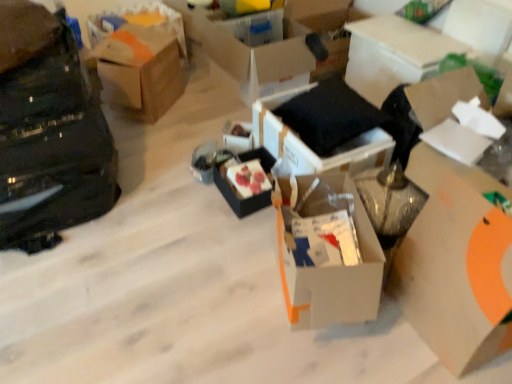
Question: Is point click(138, 38) positioned closer to the camera than point click(342, 150)?

Choices:
 (A) farther
 (B) closer

Answer: (A)

Question: Is brown cardboard box at upper left, positioned as the first box in left-to-right order, inside or outside of black fabric cushion at center, the 4th box in the right-to-left sequence?

Choices:
 (A) outside
 (B) inside

Answer: (A)

Question: Considering the real-world distances, which object is closest to the white cardboard box at right, the third box in the right-to-left sequence?

Choices:
 (A) white cardboard box at upper right, which ranks as the third storage box in left-to-right order
 (B) white cardboard box at upper center, the second box viewed from the right
 (C) black matte box at center, acting as the second box starting from the left
 (D) white cardboard box at center, marked as the 2th storage box in a left-to-right arrangement
 (E) white cardboard box at upper right, which ranks as the eighth box in left-to-right order

Answer: (E)

Question: Which of these objects is positioned closest to the white cardboard box at upper right, which ranks as the eighth box in left-to-right order?

Choices:
 (A) white cardboard box at upper right, which is counted as the first storage box, starting from the front
 (B) white cardboard box at right, the third box in the right-to-left sequence
 (C) white cardboard box at upper center, which ranks as the seventh box in left-to-right order
 (D) cardboard box at upper left, positioned as the first storage box in top-to-bottom order
 (E) black matte bag at left

Answer: (C)